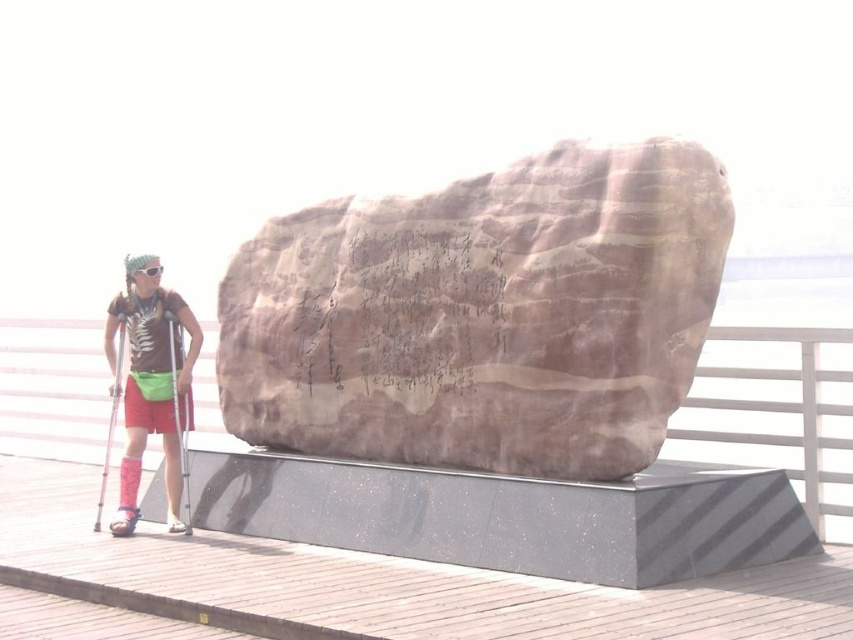
Question: Which point is farther to the camera?

Choices:
 (A) (119, 337)
 (B) (434, 262)
 (C) (84, 541)
 (D) (122, 536)

Answer: (A)

Question: Can you confirm if brown polished stone at center is smaller than matte plastic ski pole at lower left?

Choices:
 (A) no
 (B) yes

Answer: (A)

Question: Is matte plastic ski pole at lower left to the left of metallic silver ski pole at left from the viewer's perspective?

Choices:
 (A) yes
 (B) no

Answer: (B)

Question: Which point appears farthest from the camera in this image?

Choices:
 (A) (178, 339)
 (B) (277, 592)
 (C) (125, 513)

Answer: (A)

Question: Which point is closer to the camera?

Choices:
 (A) pyautogui.click(x=527, y=369)
 (B) pyautogui.click(x=167, y=314)
 (C) pyautogui.click(x=126, y=321)

Answer: (A)

Question: Can you confirm if matte brown shirt at center is wider than matte plastic ski pole at lower left?

Choices:
 (A) yes
 (B) no

Answer: (A)